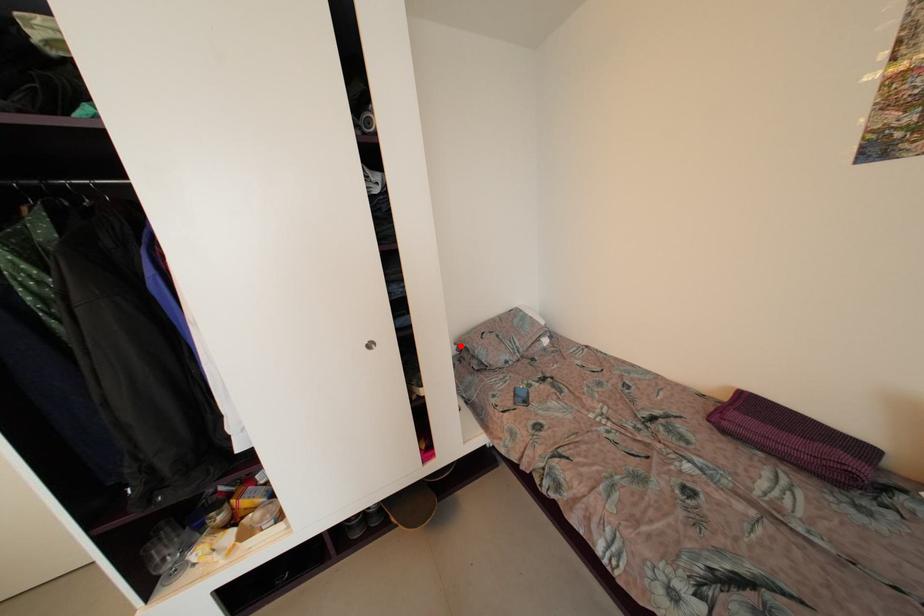
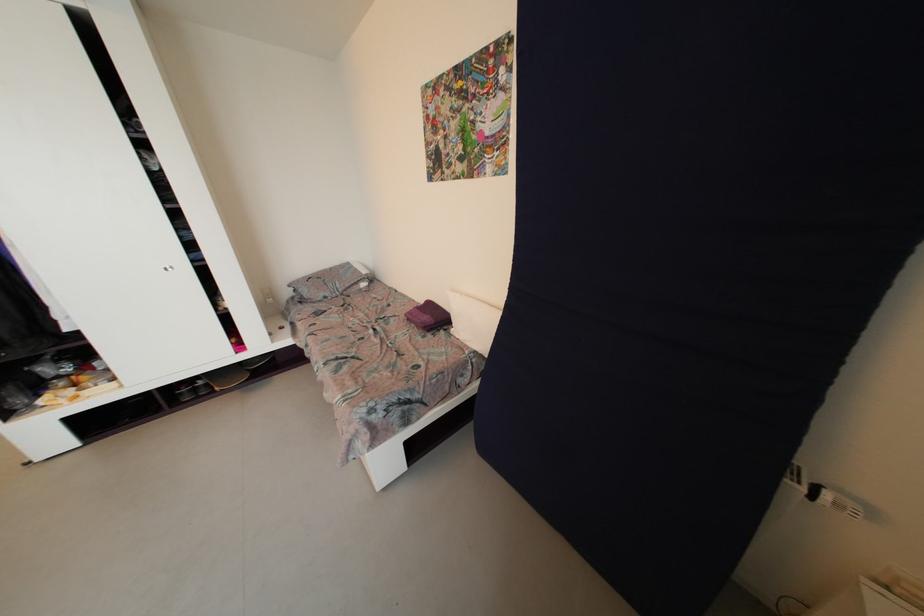
Where in the second image is the point corresponding to the highlighted location from the first image?

(294, 288)